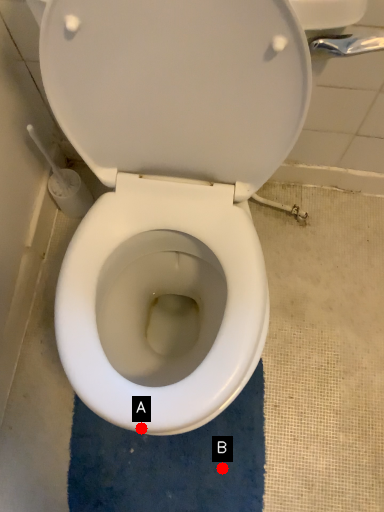
Question: Two points are circled on the image, labeled by A and B beside each circle. Which point is closer to the camera?

Choices:
 (A) A is closer
 (B) B is closer

Answer: (A)